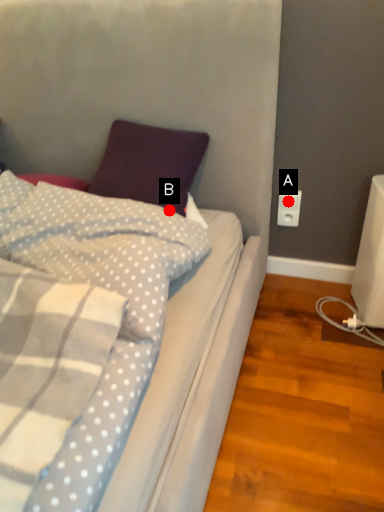
Question: Two points are circled on the image, labeled by A and B beside each circle. Which point is farther from the camera taking this photo?

Choices:
 (A) A is further
 (B) B is further

Answer: (A)